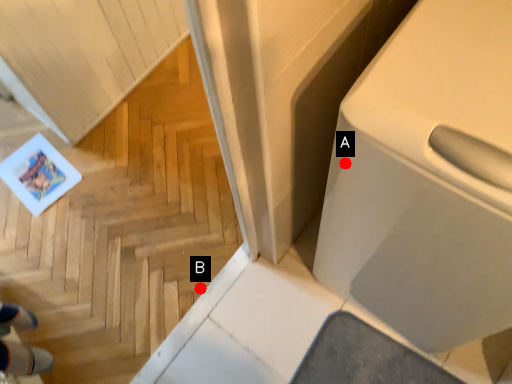
Question: Two points are circled on the image, labeled by A and B beside each circle. Which point is closer to the camera?

Choices:
 (A) A is closer
 (B) B is closer

Answer: (A)